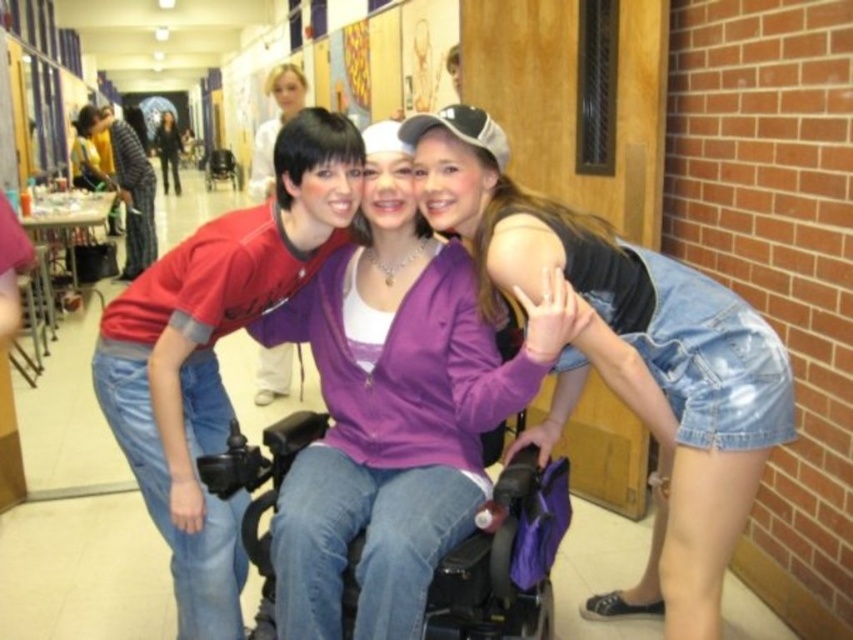
Can you confirm if purple matte jacket at center is positioned to the right of matte red shirt at left?

Indeed, purple matte jacket at center is positioned on the right side of matte red shirt at left.

Which is more to the left, purple matte jacket at center or matte red shirt at left?

matte red shirt at left

At what (x,y) coordinates should I click in order to perform the action: click on purple matte jacket at center. Please return your answer as a coordinate pair (x, y). The width and height of the screenshot is (853, 640). Looking at the image, I should click on (393, 410).

Is purple matte jacket at center wider than denim shorts at right?

In fact, purple matte jacket at center might be narrower than denim shorts at right.

Is purple matte jacket at center above denim shorts at right?

Yes.

The width and height of the screenshot is (853, 640). Find the location of `purple matte jacket at center`. purple matte jacket at center is located at coordinates (393, 410).

Identify the location of purple matte jacket at center. [393, 410].

Does denim shorts at right have a smaller size compared to matte red shirt at left?

No, denim shorts at right is not smaller than matte red shirt at left.

Which is more to the left, denim shorts at right or matte red shirt at left?

matte red shirt at left is more to the left.

Which is behind, point (447, 230) or point (178, 481)?

The point (447, 230) is behind.

Where is `denim shorts at right`? This screenshot has width=853, height=640. denim shorts at right is located at coordinates (625, 356).